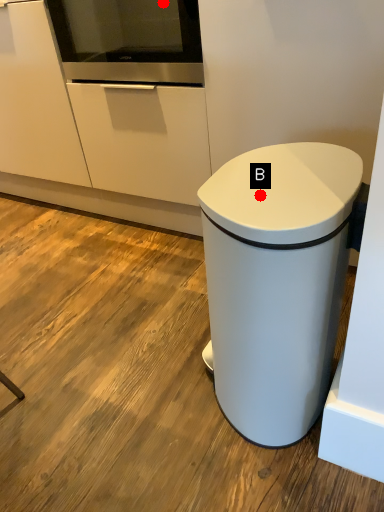
Question: Two points are circled on the image, labeled by A and B beside each circle. Which point is farther to the camera?

Choices:
 (A) A is further
 (B) B is further

Answer: (A)